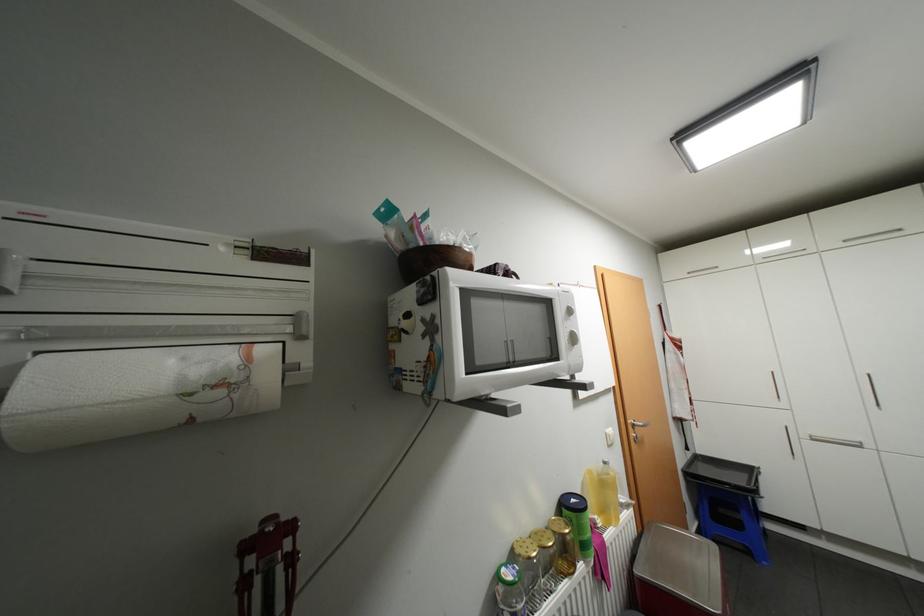
The width and height of the screenshot is (924, 616). Find the location of `silver door handle`. silver door handle is located at coordinates (637, 429).